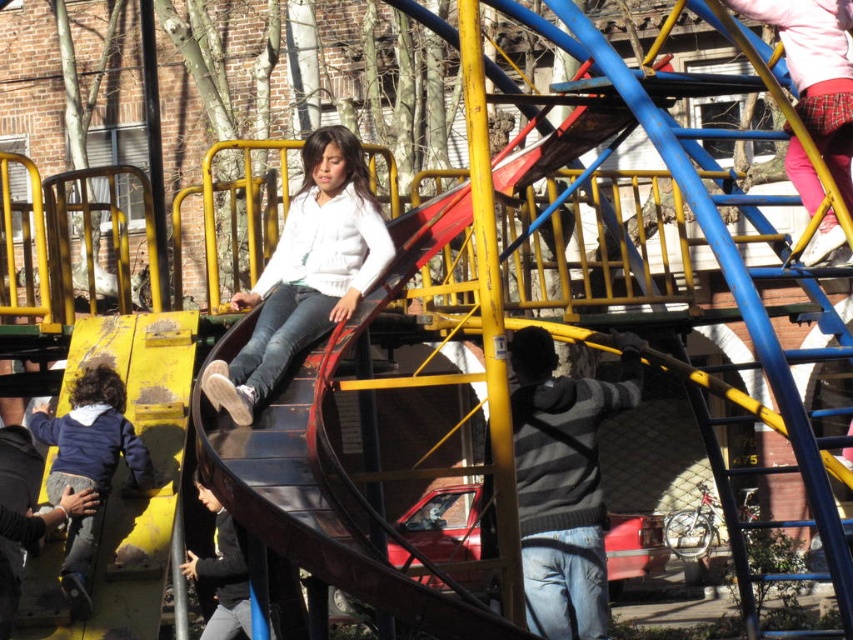
You are a photographer taking a picture of the playground. You see the white matte sweater at center and the dark blue fleece jacket at lower left. Which clothing item is positioned higher in the image?

The white matte sweater at center is above the dark blue fleece jacket at lower left, so it is positioned higher in the image.

You are a photographer taking a picture of the playground scene. You notice two children wearing a white matte sweater at center and a dark gray sweater at center. Which child is standing to the right of the other?

The white matte sweater at center is positioned on the right side of dark gray sweater at center, so the child wearing the white matte sweater at center is to the right of the child in the dark gray sweater at center.